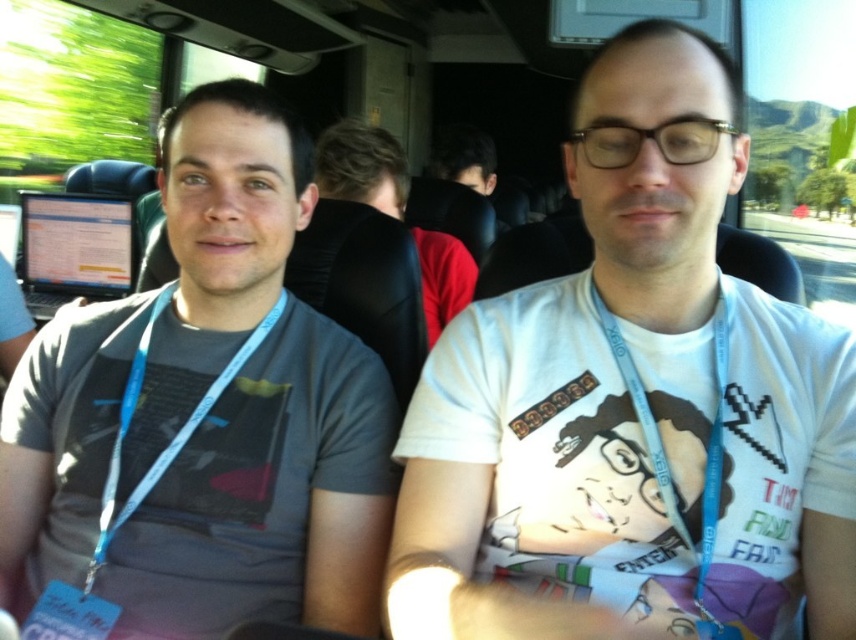
Is gray matte t-shirt at left shorter than dark brown leather jacket at center?

Incorrect, gray matte t-shirt at left's height does not fall short of dark brown leather jacket at center's.

Who is more forward, (276,307) or (395,157)?

Point (276,307) is more forward.

Identify the location of gray matte t-shirt at left. (204, 413).

From the picture: Does dark brown leather jacket at center appear over blue fabric lanyard at left?

Correct, dark brown leather jacket at center is located above blue fabric lanyard at left.

Who is more forward, (375, 134) or (171, 288)?

Positioned in front is point (171, 288).

Describe the element at coordinates (361, 166) in the screenshot. Image resolution: width=856 pixels, height=640 pixels. I see `dark brown leather jacket at center` at that location.

Locate an element on the screen. The height and width of the screenshot is (640, 856). dark brown leather jacket at center is located at coordinates (361, 166).

Which of these two, white cotton t-shirt at center or gray matte t-shirt at left, stands taller?

Standing taller between the two is gray matte t-shirt at left.

Is point (720, 461) in front of point (313, 604)?

Yes, point (720, 461) is closer to viewer.

Looking at this image, measure the distance between white cotton t-shirt at center and camera.

white cotton t-shirt at center and camera are 28.15 inches apart from each other.

Find the location of a particular element. This screenshot has width=856, height=640. white cotton t-shirt at center is located at coordinates (633, 404).